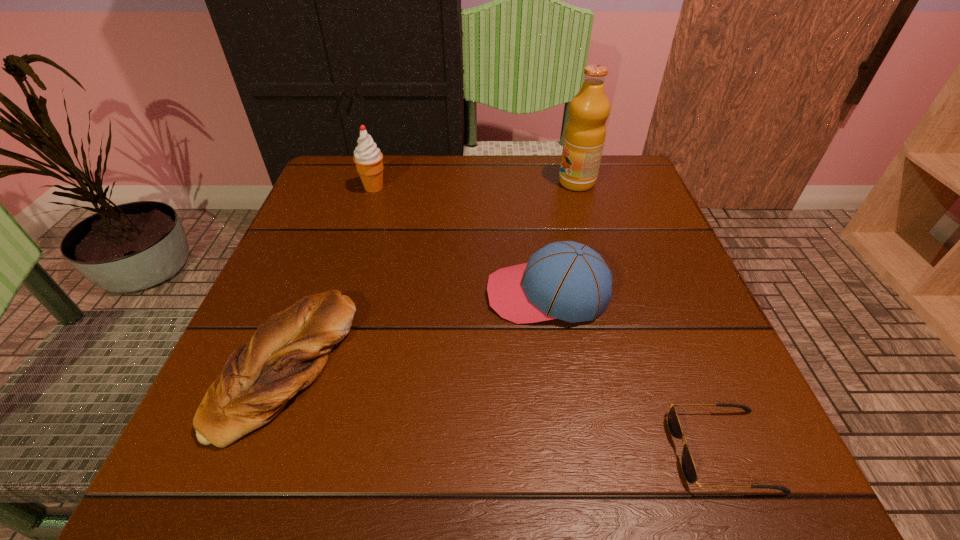
Find the location of a particular element. fruit juice is located at coordinates (585, 132).

At what (x,y) coordinates should I click in order to perform the action: click on icecream. Please return your answer as a coordinate pair (x, y). Looking at the image, I should click on (368, 159).

Locate an element on the screen. baseball cap is located at coordinates (566, 280).

Where is `the fourth tallest object`? The height and width of the screenshot is (540, 960). the fourth tallest object is located at coordinates (289, 349).

This screenshot has height=540, width=960. I want to click on the shortest object, so click(688, 467).

You are a GUI agent. You are given a task and a screenshot of the screen. Output one action in this format:
    pyautogui.click(x=<x>, y=<y>)
    Task: Click on the vacant area situated on the front label of the tallest object
    This screenshot has width=960, height=540.
    Given the screenshot: What is the action you would take?
    pyautogui.click(x=538, y=183)

Locate an element on the screen. free space located 0.270m on the front label of the tallest object is located at coordinates click(447, 183).

The width and height of the screenshot is (960, 540). Identify the location of free space located on the front label of the tallest object. (517, 183).

You are a GUI agent. You are given a task and a screenshot of the screen. Output one action in this format:
    pyautogui.click(x=<x>, y=<y>)
    Task: Click on the free space located 0.290m on the front of the second tallest object
    The height and width of the screenshot is (540, 960).
    Given the screenshot: What is the action you would take?
    pyautogui.click(x=344, y=282)

At what (x,y) coordinates should I click in order to perform the action: click on vacant space located on the front-facing side of the baseball cap. Please return your answer as a coordinate pair (x, y). Looking at the image, I should click on (421, 294).